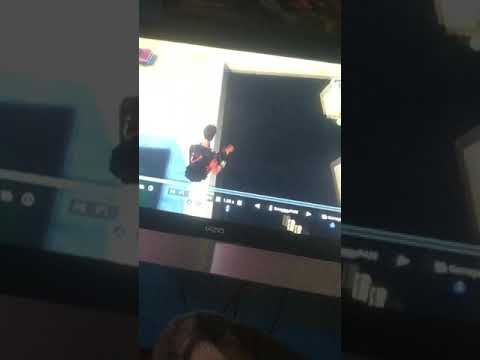
Locate an element on the screen. white wall is located at coordinates coord(188,104).